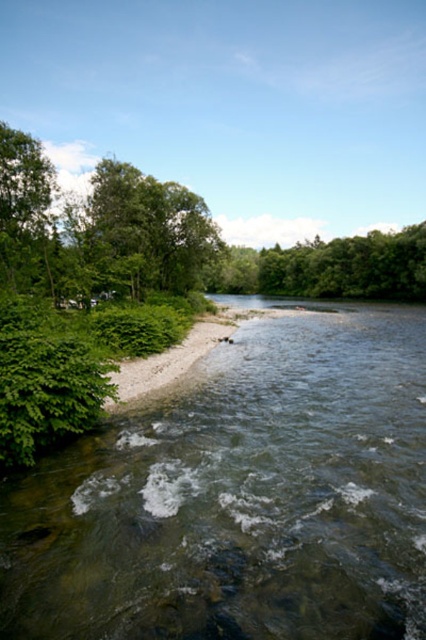
Is green leafy tree at upper left taller than green gravel shoreline at lower left?

Correct, green leafy tree at upper left is much taller as green gravel shoreline at lower left.

Is green leafy tree at upper left below green gravel shoreline at lower left?

No, green leafy tree at upper left is not below green gravel shoreline at lower left.

The width and height of the screenshot is (426, 640). Find the location of `green leafy tree at upper left`. green leafy tree at upper left is located at coordinates (147, 232).

Which is in front, point (39, 577) or point (2, 224)?

Point (39, 577) is more forward.

You are a GUI agent. You are given a task and a screenshot of the screen. Output one action in this format:
    pyautogui.click(x=<x>, y=<y>)
    Task: Click on the clear water at river center
    This screenshot has width=426, height=640.
    Given the screenshot: What is the action you would take?
    pyautogui.click(x=239, y=497)

Where is `clear water at river center`? The image size is (426, 640). clear water at river center is located at coordinates (239, 497).

Between green leafy trees at center and green gravel shoreline at lower left, which one has less height?

Standing shorter between the two is green gravel shoreline at lower left.

Does point (265, 278) come closer to viewer compared to point (164, 388)?

No, (265, 278) is further to viewer.

The image size is (426, 640). Find the location of `green leafy trees at center`. green leafy trees at center is located at coordinates (331, 268).